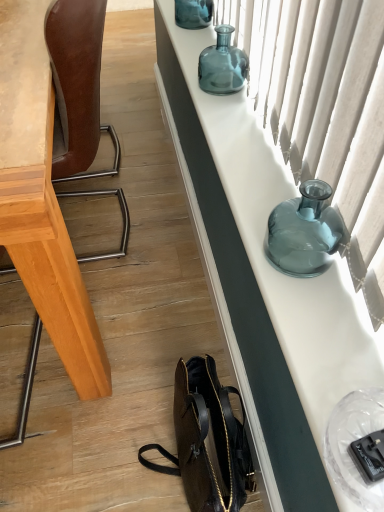
Where is `vacant area that lies between translucent glass vase at upper center, which ranks as the 2th bottle in top-to-bottom order, and translucent glass vase at upper right, the first bottle positioned from the bottom`? vacant area that lies between translucent glass vase at upper center, which ranks as the 2th bottle in top-to-bottom order, and translucent glass vase at upper right, the first bottle positioned from the bottom is located at coordinates coord(258,154).